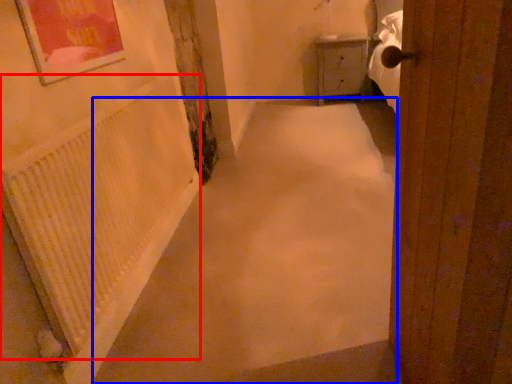
Question: Which object appears farthest to the camera in this image, radiator (highlighted by a red box) or alley (highlighted by a blue box)?

Choices:
 (A) radiator
 (B) alley

Answer: (B)